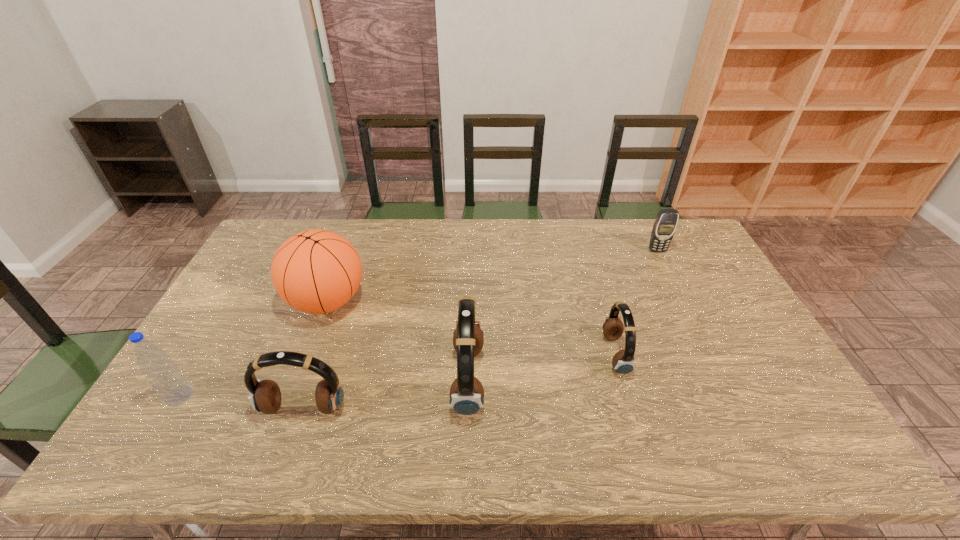
Identify the location of vacant region located on the ear cup of the rightmost headset. Image resolution: width=960 pixels, height=540 pixels. (763, 354).

The image size is (960, 540). Identify the location of vacant space located 0.240m on the front face of the farthest object. (682, 301).

Find the location of a particular element. This screenshot has height=540, width=960. vacant space situated on the left of the second farthest object is located at coordinates (226, 301).

Locate an element on the screen. This screenshot has height=540, width=960. free space located on the right of the water bottle is located at coordinates (252, 396).

Locate an element on the screen. object that is at the far edge is located at coordinates (664, 227).

Where is `water bottle at the near edge`? water bottle at the near edge is located at coordinates (164, 376).

Find the location of a particular element. The width and height of the screenshot is (960, 540). object at the left edge is located at coordinates (164, 376).

Locate an element on the screen. This screenshot has width=960, height=540. object present at the right edge is located at coordinates (664, 227).

At what (x,y) coordinates should I click in order to perform the action: click on object situated at the near left corner. Please return your answer as a coordinate pair (x, y). This screenshot has width=960, height=540. Looking at the image, I should click on (164, 376).

Find the location of a particular element. The height and width of the screenshot is (540, 960). object that is positioned at the far right corner is located at coordinates (664, 227).